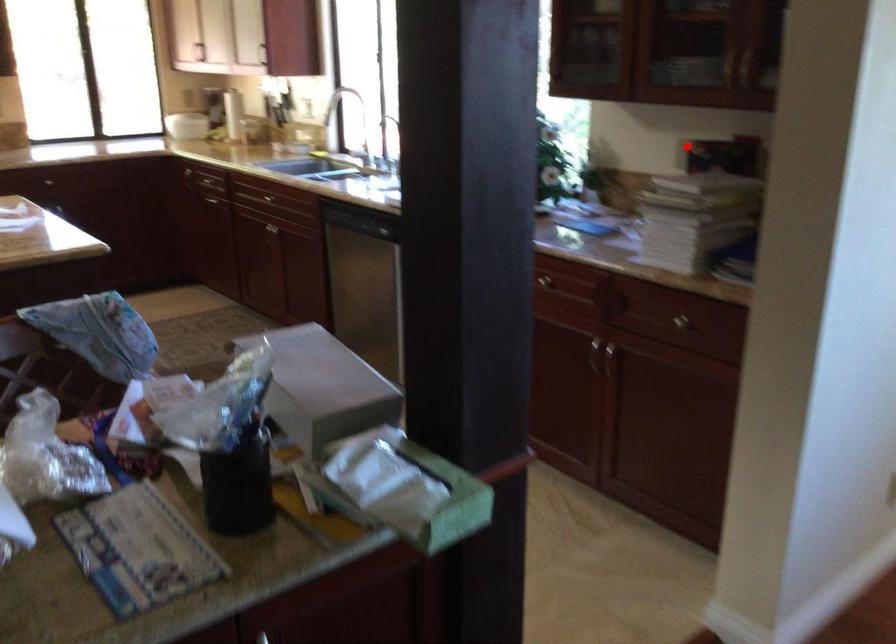
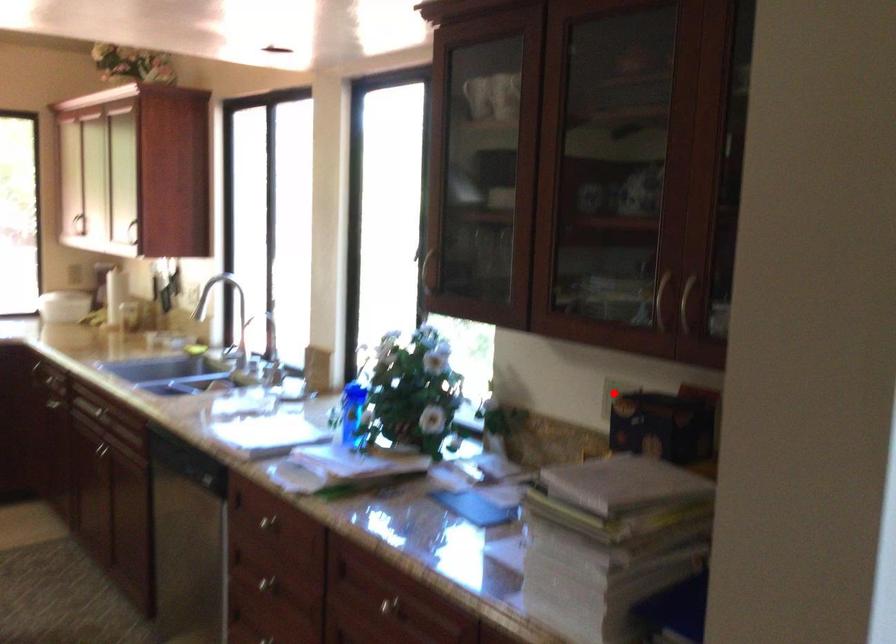
I am providing you with two images of the same scene from different viewpoints. A red point is marked on the first image and another point is marked on the second image. Are the points marked in image1 and image2 representing the same 3D position?

Yes